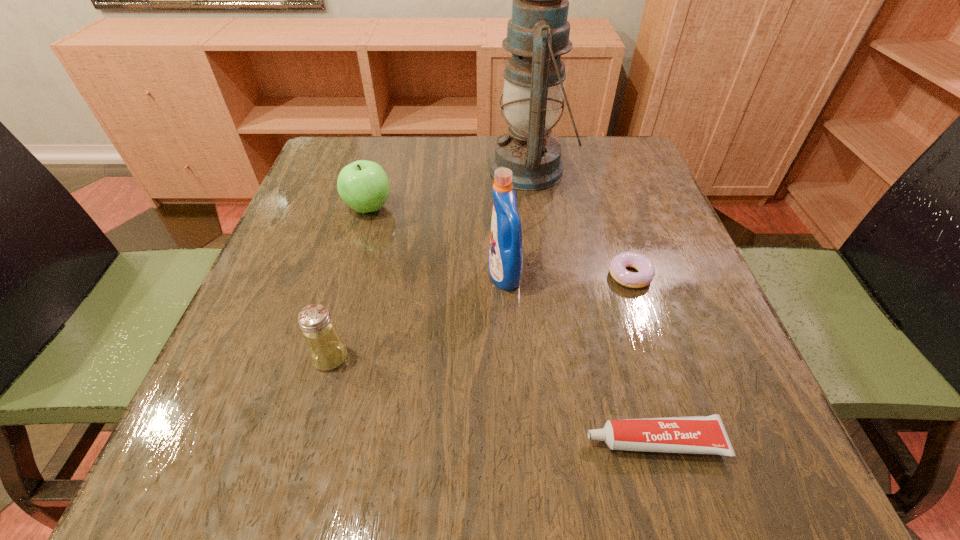
Locate an element on the screen. The image size is (960, 540). vacant area that satisfies the following two spatial constraints: 1. on the front side of the fifth farthest object; 2. on the right side of the apple is located at coordinates (325, 357).

Identify the location of free space that satisfies the following two spatial constraints: 1. on the front side of the tallest object; 2. on the label of the detergent. This screenshot has width=960, height=540. (546, 275).

Identify the location of free region that satisfies the following two spatial constraints: 1. on the back side of the oil lamp; 2. on the right side of the second nearest object. (382, 170).